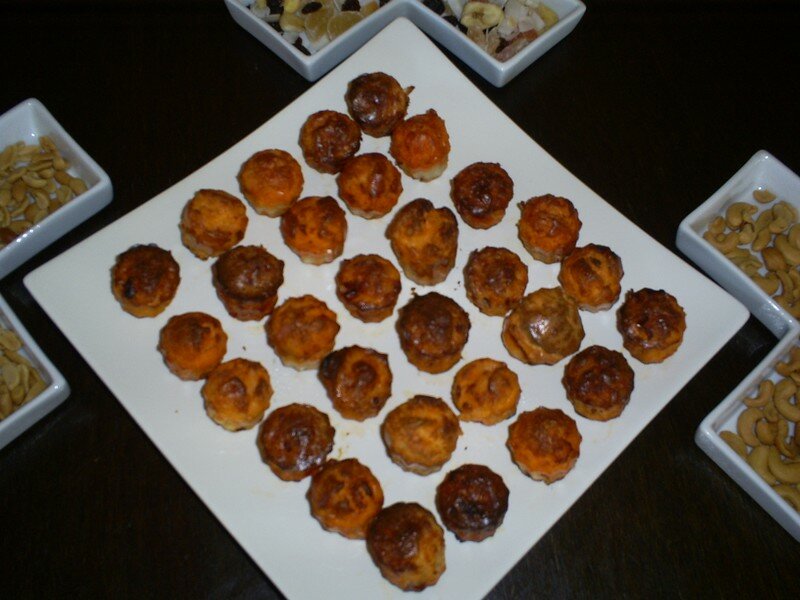
At what (x,y) coordinates should I click in order to perform the action: click on bowl. Please return your answer as a coordinate pair (x, y). This screenshot has width=800, height=600. Looking at the image, I should click on [24, 179], [326, 35], [750, 434].